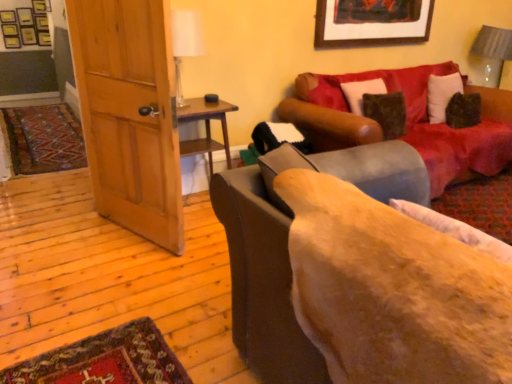
Question: From the image's perspective, is white glass table lamp at upper center on fluffy beige pillow at lower right?

Choices:
 (A) no
 (B) yes

Answer: (B)

Question: Considering the relative sizes of white glass table lamp at upper center and fluffy beige pillow at lower right in the image provided, is white glass table lamp at upper center wider than fluffy beige pillow at lower right?

Choices:
 (A) no
 (B) yes

Answer: (B)

Question: From a real-world perspective, is white glass table lamp at upper center positioned under fluffy beige pillow at lower right based on gravity?

Choices:
 (A) yes
 (B) no

Answer: (B)

Question: Is white glass table lamp at upper center oriented away from fluffy beige pillow at lower right?

Choices:
 (A) yes
 (B) no

Answer: (B)

Question: Does white glass table lamp at upper center have a lesser width compared to fluffy beige pillow at lower right?

Choices:
 (A) no
 (B) yes

Answer: (A)

Question: Can you confirm if white glass table lamp at upper center is shorter than fluffy beige pillow at lower right?

Choices:
 (A) yes
 (B) no

Answer: (B)

Question: Is white glass table lamp at upper center in front of wooden side table at left?

Choices:
 (A) yes
 (B) no

Answer: (A)

Question: Does white glass table lamp at upper center touch wooden side table at left?

Choices:
 (A) no
 (B) yes

Answer: (A)

Question: Can you confirm if white glass table lamp at upper center is wider than wooden side table at left?

Choices:
 (A) no
 (B) yes

Answer: (A)

Question: Would you consider white glass table lamp at upper center to be distant from wooden side table at left?

Choices:
 (A) yes
 (B) no

Answer: (B)

Question: Is white glass table lamp at upper center thinner than wooden side table at left?

Choices:
 (A) no
 (B) yes

Answer: (B)

Question: Is white glass table lamp at upper center at the right side of wooden side table at left?

Choices:
 (A) yes
 (B) no

Answer: (B)

Question: Considering the relative positions of wooden picture frame at upper center and velvet brown couch at center, the first studio couch viewed from the front, in the image provided, is wooden picture frame at upper center to the left of velvet brown couch at center, the first studio couch viewed from the front, from the viewer's perspective?

Choices:
 (A) yes
 (B) no

Answer: (B)